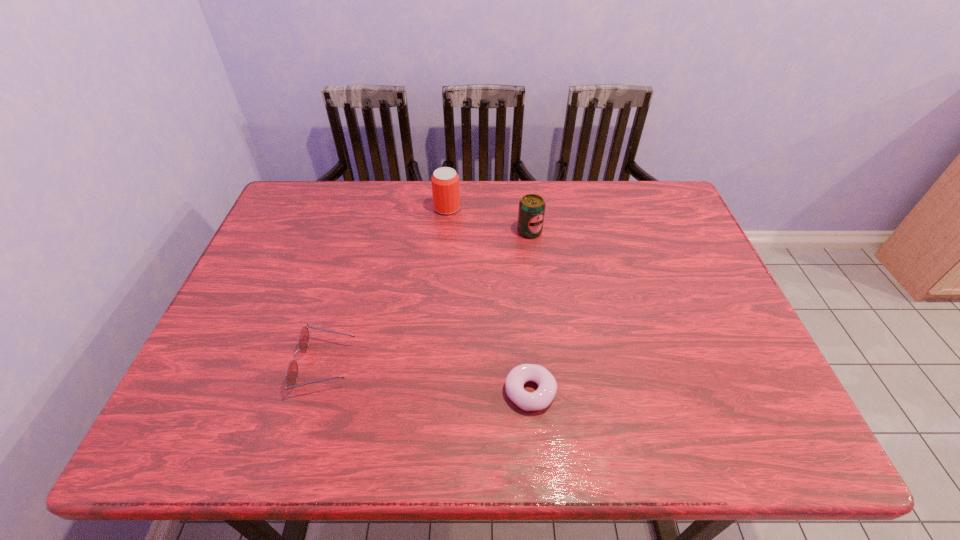
Where is `vacant point located between the leftmost object and the farthest object`? The width and height of the screenshot is (960, 540). vacant point located between the leftmost object and the farthest object is located at coordinates (386, 286).

Where is `free space between the shortest object and the leftmost object`? Image resolution: width=960 pixels, height=540 pixels. free space between the shortest object and the leftmost object is located at coordinates (428, 378).

Image resolution: width=960 pixels, height=540 pixels. In order to click on vacant region between the third tallest object and the second farthest object in this screenshot , I will do `click(427, 298)`.

Where is `vacant area that lies between the second shortest object and the nearer beer can`? This screenshot has width=960, height=540. vacant area that lies between the second shortest object and the nearer beer can is located at coordinates (x=427, y=298).

This screenshot has height=540, width=960. I want to click on empty space that is in between the farther beer can and the second shortest object, so click(386, 286).

Find the location of a particular element. Image resolution: width=960 pixels, height=540 pixels. vacant point located between the third tallest object and the shortest object is located at coordinates (428, 378).

Image resolution: width=960 pixels, height=540 pixels. Find the location of `free space between the third tallest object and the doughnut`. free space between the third tallest object and the doughnut is located at coordinates (428, 378).

The image size is (960, 540). I want to click on object that is the closest to the farther beer can, so click(531, 212).

Identify which object is located as the nearest to the doughnut. Please provide its 2D coordinates. Your answer should be formatted as a tuple, i.e. [(x, y)], where the tuple contains the x and y coordinates of a point satisfying the conditions above.

[(303, 340)]

Where is `free space that satisfies the following two spatial constraints: 1. on the front-facing side of the leftmost object; 2. on the back side of the doughnut`? Image resolution: width=960 pixels, height=540 pixels. free space that satisfies the following two spatial constraints: 1. on the front-facing side of the leftmost object; 2. on the back side of the doughnut is located at coordinates (318, 392).